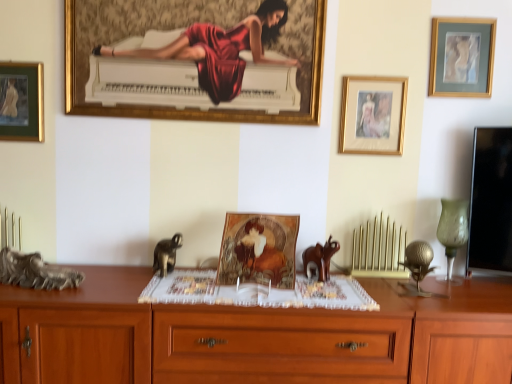
Question: From the image's perspective, is green glass vase at right positioned above or below gold-framed artwork at upper right, positioned as the first picture frame in right-to-left order?

Choices:
 (A) above
 (B) below

Answer: (B)

Question: From a real-world perspective, is green glass vase at right above or below gold-framed artwork at upper right, positioned as the first picture frame in right-to-left order?

Choices:
 (A) below
 (B) above

Answer: (A)

Question: Which object is positioned farthest from the gold-framed painting at upper center, placed as the 3th picture frame when sorted from right to left?

Choices:
 (A) gold-framed picture at center-right, which ranks as the second picture frame in right-to-left order
 (B) rustic wood sculpture at left, the 3th animal when ordered from right to left
 (C) green matte picture frame at upper left, the 1th picture frame when ordered from left to right
 (D) gold-framed artwork at upper right, positioned as the first picture frame in right-to-left order
 (E) wooden drawer at center

Answer: (E)

Question: Estimate the real-world distances between objects in this image. Which object is farther from the gold-framed painting at upper center, the second picture frame from the left?

Choices:
 (A) green glass vase at right
 (B) gold-framed artwork at upper right, which is the 4th picture frame in left-to-right order
 (C) brown matte elephant at center, the 3th animal from the left
 (D) wooden cabinet at lower left
 (E) metallic gray monkey at center-left, positioned as the 2th animal in right-to-left order

Answer: (A)